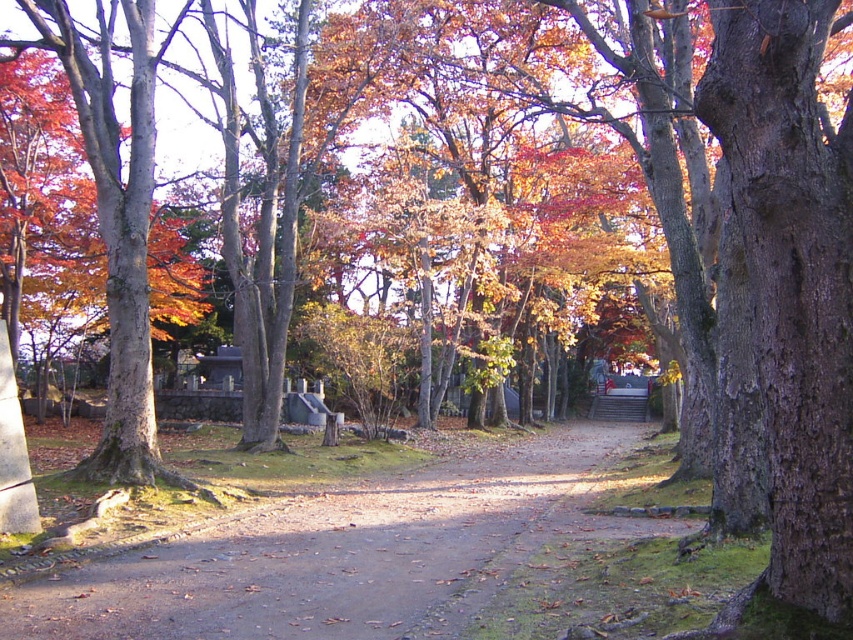
Question: Is dirt path at center below smooth bark tree at left?

Choices:
 (A) no
 (B) yes

Answer: (B)

Question: Which object is closer to the camera taking this photo?

Choices:
 (A) smooth bark tree at left
 (B) dirt path at center

Answer: (B)

Question: Observing the image, what is the correct spatial positioning of dirt path at center in reference to smooth bark tree at left?

Choices:
 (A) right
 (B) left

Answer: (A)

Question: Is dirt path at center closer to the viewer compared to smooth bark tree at left?

Choices:
 (A) yes
 (B) no

Answer: (A)